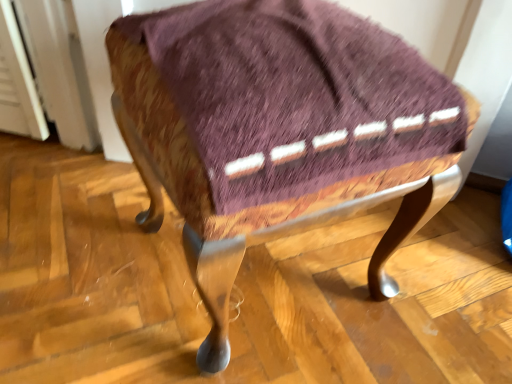
Identify the location of free region on the left part of woven fabric stool at center. The width and height of the screenshot is (512, 384). (82, 251).